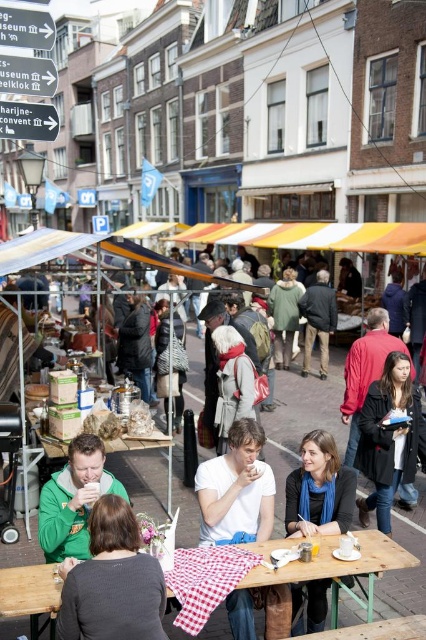
Which is above, matte black jacket at right or green matte jacket at lower left?

matte black jacket at right is higher up.

Who is shorter, matte black jacket at right or green matte jacket at lower left?

Standing shorter between the two is green matte jacket at lower left.

I want to click on matte black jacket at right, so click(x=388, y=438).

This screenshot has width=426, height=640. I want to click on matte black jacket at right, so click(388, 438).

Is wooden picnic table at center shorter than dark gray jacket at center?

Indeed, wooden picnic table at center has a lesser height compared to dark gray jacket at center.

Describe the element at coordinates (340, 564) in the screenshot. This screenshot has width=426, height=640. I see `wooden picnic table at center` at that location.

Where is `wooden picnic table at center`? wooden picnic table at center is located at coordinates (340, 564).

Can you confirm if matte black jacket at right is positioned to the left of blue scarf at lower center?

Incorrect, matte black jacket at right is not on the left side of blue scarf at lower center.

Can you confirm if matte black jacket at right is thinner than blue scarf at lower center?

No, matte black jacket at right is not thinner than blue scarf at lower center.

Who is more forward, (391, 467) or (310, 534)?

Point (310, 534) is in front.

This screenshot has width=426, height=640. I want to click on matte black jacket at right, so click(x=388, y=438).